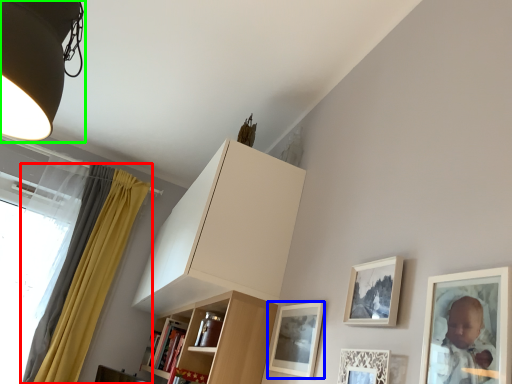
Question: Which is farther away from curtain (highlighted by a red box)? picture frame (highlighted by a blue box) or lamp (highlighted by a green box)?

Choices:
 (A) picture frame
 (B) lamp

Answer: (B)